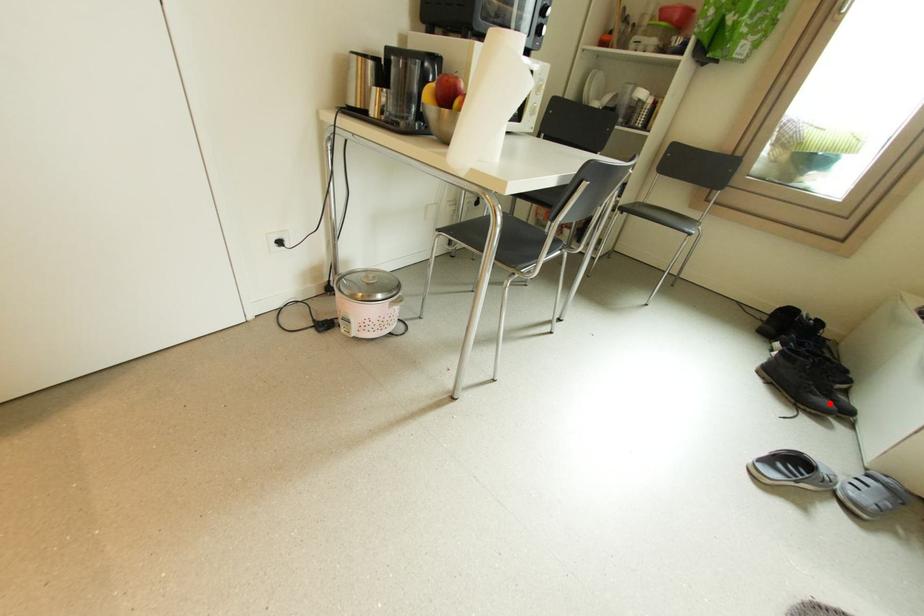
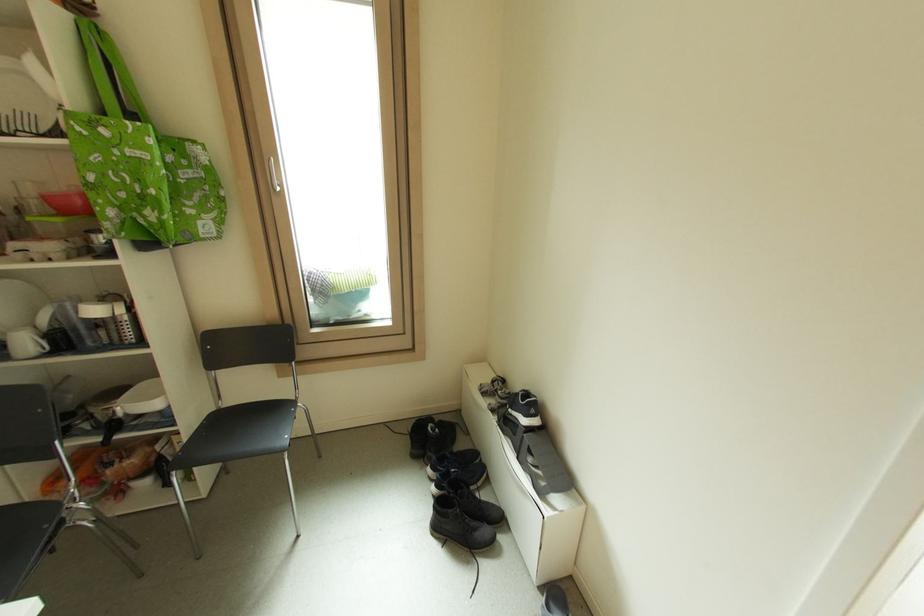
Question: I am providing you with two images of the same scene from different viewpoints. A red point is shown in image1. For the corresponding object point in image2, is it positioned nearer or farther from the camera?

Choices:
 (A) Nearer
 (B) Farther

Answer: (A)